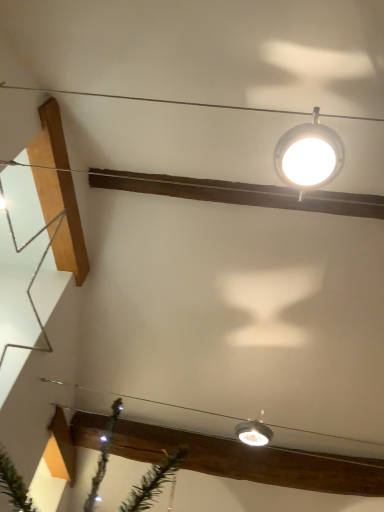
Question: Is matte silver lamp at lower center, which ranks as the second lamp in front-to-back order, located outside metallic silver star at left?

Choices:
 (A) no
 (B) yes

Answer: (B)

Question: From a real-world perspective, is matte silver lamp at lower center, which ranks as the second lamp in front-to-back order, positioned over metallic silver star at left based on gravity?

Choices:
 (A) yes
 (B) no

Answer: (B)

Question: Is matte silver lamp at lower center, which ranks as the 1th lamp in bottom-to-top order, bigger than metallic silver star at left?

Choices:
 (A) yes
 (B) no

Answer: (B)

Question: From a real-world perspective, is matte silver lamp at lower center, which ranks as the 1th lamp in bottom-to-top order, under metallic silver star at left?

Choices:
 (A) yes
 (B) no

Answer: (A)

Question: Is matte silver lamp at lower center, which ranks as the 1th lamp in bottom-to-top order, smaller than metallic silver star at left?

Choices:
 (A) yes
 (B) no

Answer: (A)

Question: Choose the correct answer: Is white glossy lamp at upper center, positioned as the 1th lamp in front-to-back order, inside metallic silver star at left or outside it?

Choices:
 (A) outside
 (B) inside

Answer: (A)

Question: Looking at the image, does white glossy lamp at upper center, acting as the 2th lamp starting from the bottom, seem bigger or smaller compared to metallic silver star at left?

Choices:
 (A) small
 (B) big

Answer: (A)

Question: From a real-world perspective, is white glossy lamp at upper center, positioned as the 1th lamp in front-to-back order, above or below metallic silver star at left?

Choices:
 (A) above
 (B) below

Answer: (B)

Question: In terms of height, does white glossy lamp at upper center, the second lamp in the back-to-front sequence, look taller or shorter compared to metallic silver star at left?

Choices:
 (A) tall
 (B) short

Answer: (B)

Question: Is clear plastic wire at lower center to the left or to the right of white glossy lamp at upper center, positioned as the 1th lamp in top-to-bottom order, in the image?

Choices:
 (A) left
 (B) right

Answer: (A)

Question: From a real-world perspective, is clear plastic wire at lower center above or below white glossy lamp at upper center, the second lamp in the back-to-front sequence?

Choices:
 (A) below
 (B) above

Answer: (B)

Question: Considering the positions of clear plastic wire at lower center and white glossy lamp at upper center, the second lamp in the back-to-front sequence, in the image, is clear plastic wire at lower center bigger or smaller than white glossy lamp at upper center, the second lamp in the back-to-front sequence,?

Choices:
 (A) big
 (B) small

Answer: (A)

Question: From the image's perspective, is clear plastic wire at lower center positioned above or below white glossy lamp at upper center, acting as the 2th lamp starting from the bottom?

Choices:
 (A) above
 (B) below

Answer: (B)

Question: In terms of size, does white glossy lamp at upper center, positioned as the 1th lamp in top-to-bottom order, appear bigger or smaller than matte silver lamp at lower center, which is the 1th lamp in back-to-front order?

Choices:
 (A) small
 (B) big

Answer: (B)

Question: Considering the relative positions of white glossy lamp at upper center, acting as the 2th lamp starting from the bottom, and matte silver lamp at lower center, which is the 1th lamp in back-to-front order, in the image provided, is white glossy lamp at upper center, acting as the 2th lamp starting from the bottom, to the left or to the right of matte silver lamp at lower center, which is the 1th lamp in back-to-front order,?

Choices:
 (A) right
 (B) left

Answer: (A)